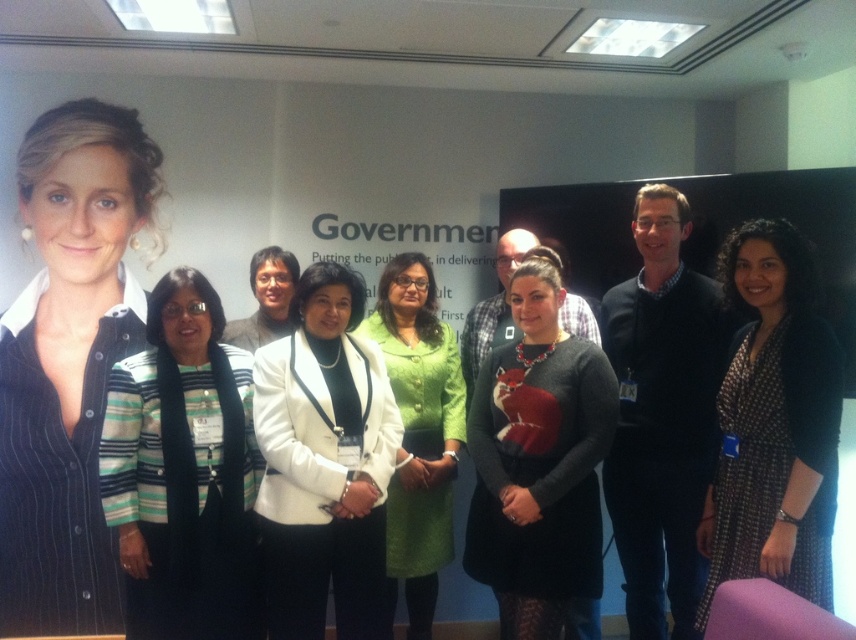
You are organizing a photo shoot and need to ensure that the white matte blazer at center and the green textured skirt at center are visible in the final image. Based on their positions, which one should you focus on first to ensure both are in frame?

The white matte blazer at center is positioned on the left side of the green textured skirt at center. To ensure both are in frame, focus on the white matte blazer at center first as it is closer to the edge on the left, then adjust to include the green textured skirt at center on the right.

You are organizing a photoshoot and need to ensure that all clothing items are visible in the photo. Given that the gray sweater at center and the green textured blazer at center are both at the center, which clothing item might be partially hidden by the other?

The gray sweater at center is bigger than the green textured blazer at center, so the green textured blazer at center might be partially hidden by the gray sweater at center.